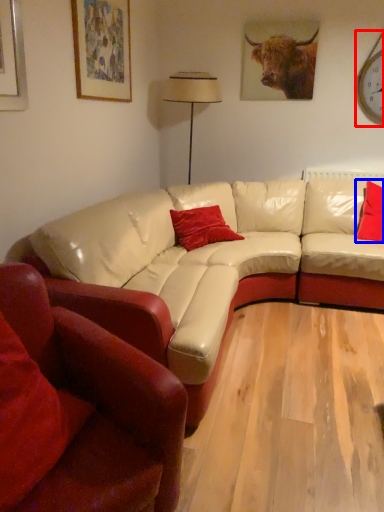
Question: Which object appears farthest to the camera in this image, clock (highlighted by a red box) or pillow (highlighted by a blue box)?

Choices:
 (A) clock
 (B) pillow

Answer: (A)